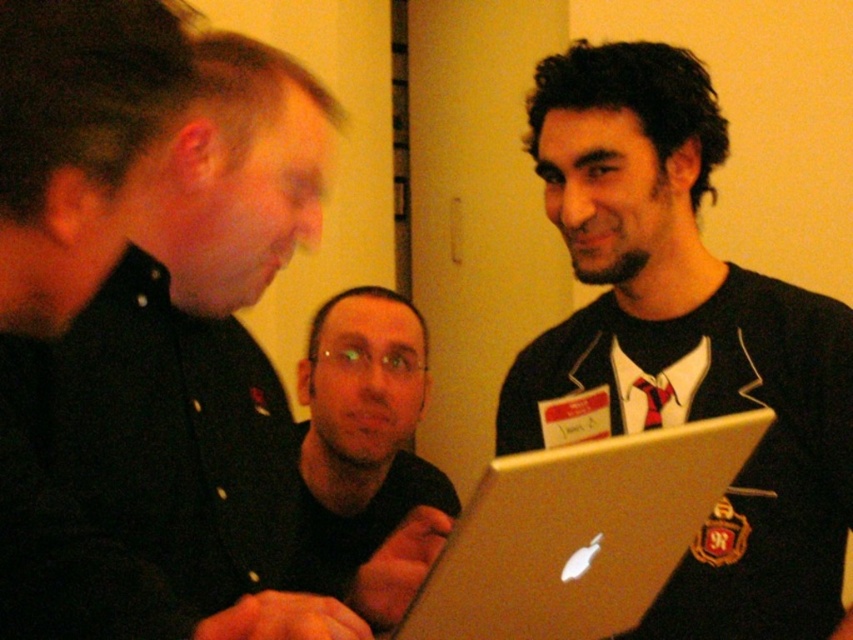
You are a photographer trying to capture a candid shot of the group. Since the silver metallic laptop at center and the matte black shirt at center are both in the frame, which object is positioned lower in the image?

The silver metallic laptop at center is located below the matte black shirt at center, so it is positioned lower in the image.